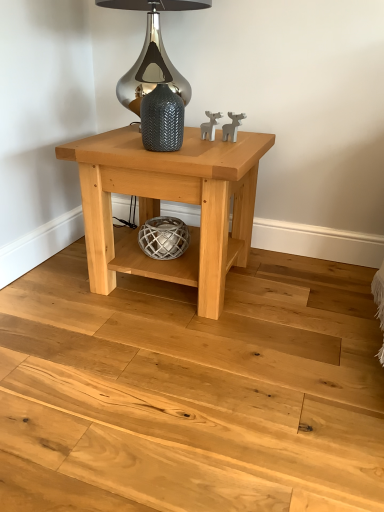
Find the location of a particular element. The width and height of the screenshot is (384, 512). vacant space situated on the left part of textured gray vase at center is located at coordinates (115, 147).